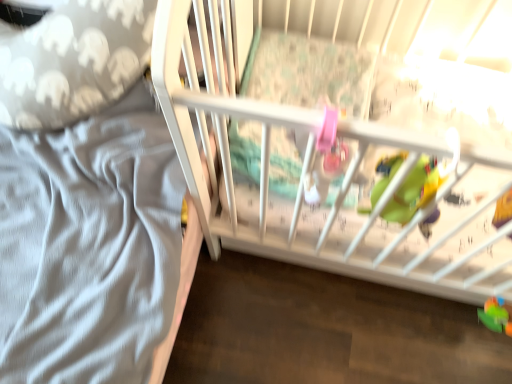
Question: Is gray elephant-patterned pillow at left situated inside rubberized green toy at lower right, the first toy in the front-to-back sequence, or outside?

Choices:
 (A) inside
 (B) outside

Answer: (B)

Question: Is gray elephant-patterned pillow at left bigger or smaller than rubberized green toy at lower right, acting as the 1th toy starting from the top?

Choices:
 (A) big
 (B) small

Answer: (A)

Question: Which is farther from the green plastic toy at lower right, arranged as the second toy when viewed from the front?

Choices:
 (A) gray elephant-patterned pillow at left
 (B) rubberized green toy at lower right, acting as the 1th toy starting from the top

Answer: (A)

Question: Which is farther from the gray elephant-patterned pillow at left?

Choices:
 (A) green plastic toy at lower right, which appears as the first toy when ordered from the bottom
 (B) rubberized green toy at lower right, the first toy from the left

Answer: (A)